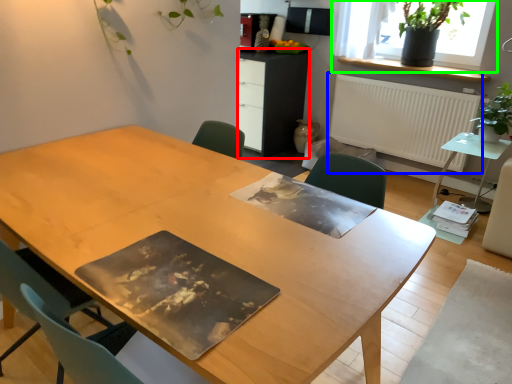
Question: Considering the real-world distances, which object is closest to computer desk (highlighted by a red box)? radiator (highlighted by a blue box) or window (highlighted by a green box).

Choices:
 (A) radiator
 (B) window

Answer: (A)